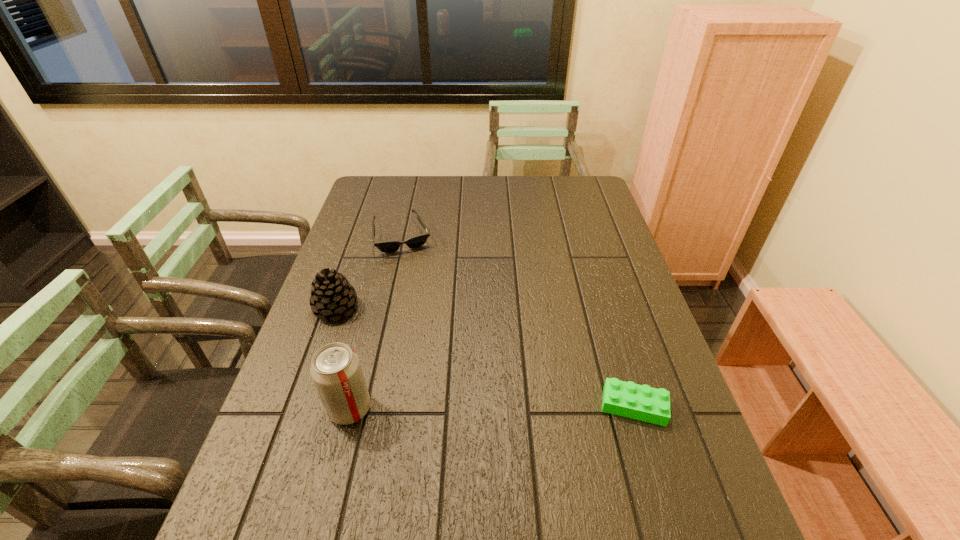
Find the location of a particular element. This screenshot has width=960, height=540. vacant space at the near left corner is located at coordinates (294, 497).

The width and height of the screenshot is (960, 540). I want to click on vacant space at the far right corner of the desktop, so click(x=599, y=208).

This screenshot has width=960, height=540. What are the coordinates of `free area in between the sunglasses and the tallest object` in the screenshot? It's located at (375, 322).

At what (x,y) coordinates should I click in order to perform the action: click on empty location between the farthest object and the rightmost object. Please return your answer as a coordinate pair (x, y). The height and width of the screenshot is (540, 960). Looking at the image, I should click on (518, 321).

Where is `vacant point located between the farthest object and the third shortest object`? This screenshot has width=960, height=540. vacant point located between the farthest object and the third shortest object is located at coordinates (369, 272).

Where is `empty location between the tallest object and the Lego`? empty location between the tallest object and the Lego is located at coordinates (492, 407).

The width and height of the screenshot is (960, 540). I want to click on free space between the farthest object and the Lego, so click(x=518, y=321).

Find the location of a particular element. This screenshot has height=540, width=960. vacant space that's between the soda can and the farthest object is located at coordinates (375, 322).

I want to click on free point between the rightmost object and the tallest object, so click(492, 407).

Identify the location of free space between the farthest object and the Lego. Image resolution: width=960 pixels, height=540 pixels. (518, 321).